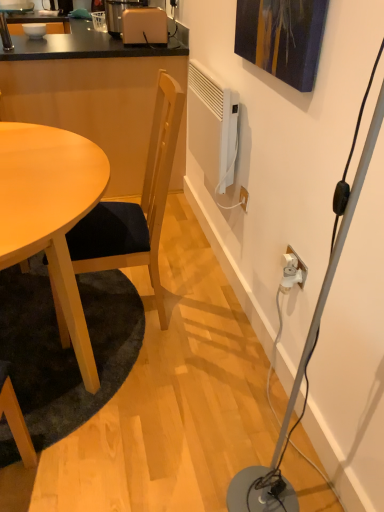
What do you see at coordinates (119, 13) in the screenshot? Image resolution: width=384 pixels, height=512 pixels. I see `beige plastic coffee machine at upper center` at bounding box center [119, 13].

In order to face beige plastic coffee machine at upper center, should I rotate leftwards or rightwards?

Rotate left and turn 7.946 degrees.

At what (x,y) coordinates should I click in order to perform the action: click on wooden chair at center. Please return your answer as a coordinate pair (x, y). Looking at the image, I should click on (135, 205).

I want to click on light wood table at left, so click(x=50, y=212).

Describe the element at coordinates (290, 277) in the screenshot. This screenshot has width=384, height=512. I see `white plastic plug at lower right, the 2th plug from the back` at that location.

What do you see at coordinates (64, 349) in the screenshot? Image resolution: width=384 pixels, height=512 pixels. I see `light brown wooden table at lower left` at bounding box center [64, 349].

The height and width of the screenshot is (512, 384). What do you see at coordinates (293, 271) in the screenshot?
I see `white plastic power outlet at lower right, acting as the first power outlet starting from the right` at bounding box center [293, 271].

At what (x,y) coordinates should I click in order to perform the action: click on matte wood table at left. Please return your answer as a coordinate pair (x, y). The width and height of the screenshot is (384, 512). Looking at the image, I should click on (92, 92).

Is matte beige toaster at upper center spatially inside white plastic power outlet at lower right, the first power outlet positioned from the back, or outside of it?

matte beige toaster at upper center is outside white plastic power outlet at lower right, the first power outlet positioned from the back.

Between matte beige toaster at upper center and white plastic power outlet at lower right, the first power outlet positioned from the back, which one has more height?

matte beige toaster at upper center.

In the scene shown: Is matte beige toaster at upper center directly adjacent to white plastic power outlet at lower right, the 1th power outlet from the top?

matte beige toaster at upper center and white plastic power outlet at lower right, the 1th power outlet from the top, are not in contact.

Considering the sizes of objects matte beige toaster at upper center and white plastic power outlet at lower right, which is the 2th power outlet in bottom-to-top order, in the image provided, who is wider, matte beige toaster at upper center or white plastic power outlet at lower right, which is the 2th power outlet in bottom-to-top order,?

With larger width is matte beige toaster at upper center.

Is white plastic power outlet at lower right, the 1th power outlet from the top, taller or shorter than beige plastic coffee machine at upper center?

Clearly, white plastic power outlet at lower right, the 1th power outlet from the top, is shorter compared to beige plastic coffee machine at upper center.

Between white plastic power outlet at lower right, which ranks as the 2th power outlet in front-to-back order, and beige plastic coffee machine at upper center, which one appears on the left side from the viewer's perspective?

From the viewer's perspective, beige plastic coffee machine at upper center appears more on the left side.

From a real-world perspective, who is located higher, white plastic power outlet at lower right, the 1th power outlet from the top, or beige plastic coffee machine at upper center?

beige plastic coffee machine at upper center is physically above.

Is white plastic power outlet at lower right, the 1th power outlet from the top, touching beige plastic coffee machine at upper center?

white plastic power outlet at lower right, the 1th power outlet from the top, and beige plastic coffee machine at upper center are not in contact.

Considering the sizes of matte wood table at left and wooden chair at center in the image, is matte wood table at left bigger or smaller than wooden chair at center?

matte wood table at left is bigger than wooden chair at center.

From a real-world perspective, between matte wood table at left and wooden chair at center, who is vertically higher?

wooden chair at center, from a real-world perspective.

Is matte wood table at left aimed at wooden chair at center?

No.

In the scene shown: Can you see matte wood table at left touching wooden chair at center?

No, matte wood table at left is not making contact with wooden chair at center.

In the image, is light brown wooden table at lower left positioned in front of or behind white plastic plug at lower right, acting as the first plug starting from the front?

Visually, light brown wooden table at lower left is located in front of white plastic plug at lower right, acting as the first plug starting from the front.

From the image's perspective, which is above, light brown wooden table at lower left or white plastic plug at lower right, acting as the first plug starting from the front?

white plastic plug at lower right, acting as the first plug starting from the front.

I want to click on flat below the white plastic plug at lower right, acting as the first plug starting from the front (from the image's perspective), so click(64, 349).

Does point (32, 102) come closer to viewer compared to point (252, 483)?

No.

Consider the image. Is matte wood table at left outside of white plastic lamp at lower right?

Yes.

Could you tell me if matte wood table at left is turned towards white plastic lamp at lower right?

No, matte wood table at left is not oriented towards white plastic lamp at lower right.

Who is bigger, matte beige toaster at upper center or light brown wooden table at lower left?

light brown wooden table at lower left.

Is light brown wooden table at lower left at the back of matte beige toaster at upper center?

No, matte beige toaster at upper center's orientation is not away from light brown wooden table at lower left.

Is point (141, 8) closer or farther from the camera than point (93, 275)?

Point (141, 8) appears to be farther away from the viewer than point (93, 275).

Considering the relative sizes of matte beige toaster at upper center and light brown wooden table at lower left in the image provided, is matte beige toaster at upper center wider than light brown wooden table at lower left?

No, matte beige toaster at upper center is not wider than light brown wooden table at lower left.

Between white plastic plug at lower right, the 2th plug viewed from the front, and white plastic power outlet at lower right, acting as the 2th power outlet starting from the top, which one has larger width?

Wider between the two is white plastic plug at lower right, the 2th plug viewed from the front.

Between point (293, 261) and point (292, 262), which one is positioned behind?

The point (293, 261) is behind.

Is white plastic plug at lower right, marked as the 1th plug in a back-to-front arrangement, facing away from white plastic power outlet at lower right, acting as the 2th power outlet starting from the left?

Yes, white plastic plug at lower right, marked as the 1th plug in a back-to-front arrangement, is facing away from white plastic power outlet at lower right, acting as the 2th power outlet starting from the left.

From the image's perspective, is white plastic plug at lower right, marked as the 1th plug in a back-to-front arrangement, below white plastic power outlet at lower right, positioned as the 2th power outlet in back-to-front order?

Incorrect, from the image's perspective, white plastic plug at lower right, marked as the 1th plug in a back-to-front arrangement, is higher than white plastic power outlet at lower right, positioned as the 2th power outlet in back-to-front order.

I want to click on toaster that appears on the left of white plastic power outlet at lower right, which ranks as the 2th power outlet in front-to-back order, so click(x=144, y=26).

Identify the location of the 1st power outlet below when counting from the beige plastic coffee machine at upper center (from the image's perspective). (244, 198).

Looking at the image, which one is located further to white plastic plug at lower right, the 2th plug from the back, white glossy bowl at upper left or white plastic power outlet at lower right, acting as the first power outlet starting from the right?

Among the two, white glossy bowl at upper left is located further to white plastic plug at lower right, the 2th plug from the back.

From the image, which object appears to be nearer to light wood table at left, beige plastic coffee machine at upper center or white plastic power outlet at lower right, positioned as the 2th power outlet in back-to-front order?

white plastic power outlet at lower right, positioned as the 2th power outlet in back-to-front order, lies closer to light wood table at left than the other object.

Looking at the image, which one is located further to white plastic power outlet at lower right, acting as the first power outlet starting from the right, white glossy bowl at upper left or wooden chair at center?

white glossy bowl at upper left is further to white plastic power outlet at lower right, acting as the first power outlet starting from the right.

Considering their positions, is white glossy bowl at upper left positioned closer to white plastic plug at lower right, the 2th plug from the back, than matte wood table at left?

matte wood table at left lies closer to white plastic plug at lower right, the 2th plug from the back, than the other object.

Estimate the real-world distances between objects in this image. Which object is further from light brown wooden table at lower left, white plastic lamp at lower right or white plastic power outlet at lower right, the 1th power outlet in the left-to-right sequence?

white plastic power outlet at lower right, the 1th power outlet in the left-to-right sequence.

Estimate the real-world distances between objects in this image. Which object is closer to light wood table at left, white plastic plug at lower right, the 2th plug viewed from the front, or white plastic power outlet at lower right, positioned as the 2th power outlet in back-to-front order?

white plastic power outlet at lower right, positioned as the 2th power outlet in back-to-front order, is positioned closer to the anchor light wood table at left.

When comparing their distances from white plastic plug at lower right, marked as the 1th plug in a back-to-front arrangement, does wooden chair at center or matte wood table at left seem closer?

wooden chair at center is closer to white plastic plug at lower right, marked as the 1th plug in a back-to-front arrangement.

From the image, which object appears to be nearer to white plastic power outlet at lower right, the first power outlet positioned from the back, matte wood table at left or white plastic plug at lower right, acting as the first plug starting from the front?

white plastic plug at lower right, acting as the first plug starting from the front, is positioned closer to the anchor white plastic power outlet at lower right, the first power outlet positioned from the back.

Identify the location of desk positioned between white plastic lamp at lower right and white glossy bowl at upper left from near to far. (50, 212).

I want to click on bowl between beige plastic coffee machine at upper center and white plastic plug at lower right, acting as the first plug starting from the front, vertically, so click(x=34, y=30).

Where is `plug between matte wood table at left and white plastic plug at lower right, the 2th plug from the back, in the up-down direction`? Image resolution: width=384 pixels, height=512 pixels. plug between matte wood table at left and white plastic plug at lower right, the 2th plug from the back, in the up-down direction is located at coordinates (291, 260).

At what (x,y) coordinates should I click in order to perform the action: click on plug positioned between white plastic power outlet at lower right, positioned as the 2th power outlet in back-to-front order, and white plastic power outlet at lower right, which ranks as the 2th power outlet in front-to-back order, from near to far. Please return your answer as a coordinate pair (x, y). The width and height of the screenshot is (384, 512). Looking at the image, I should click on (291, 260).